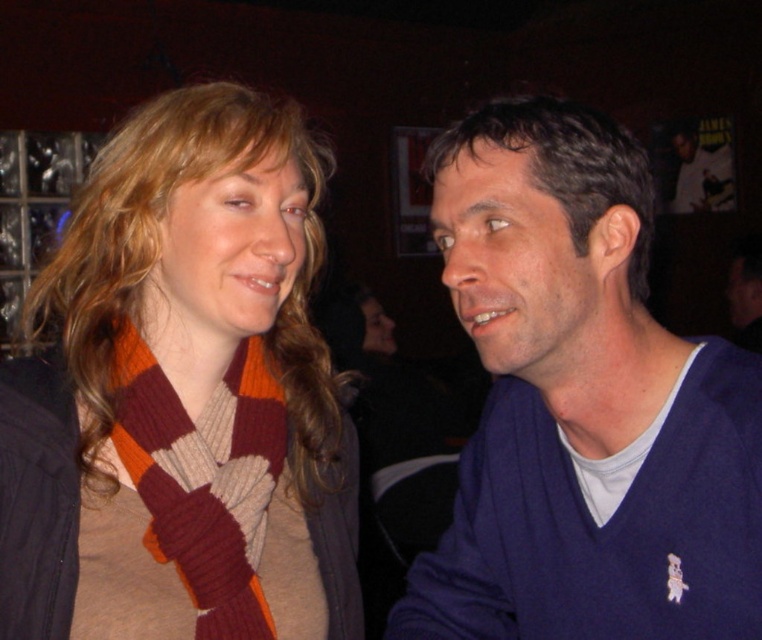
Question: Which point appears farthest from the camera in this image?

Choices:
 (A) (588, 205)
 (B) (740, 259)

Answer: (B)

Question: Can you confirm if blue sweater at right is thinner than dark brown smooth hair at upper right?

Choices:
 (A) no
 (B) yes

Answer: (A)

Question: Can you confirm if blue sweater at right is wider than dark brown smooth hair at upper right?

Choices:
 (A) no
 (B) yes

Answer: (B)

Question: Which object is the closest to the dark brown smooth hair at upper right?

Choices:
 (A) knitted scarf at center
 (B) matte blue sweater at right
 (C) knitted wool scarf at left
 (D) blue sweater at right

Answer: (D)

Question: Which of these objects is positioned farthest from the dark brown smooth hair at upper right?

Choices:
 (A) matte blue sweater at right
 (B) knitted scarf at center
 (C) knitted wool scarf at left

Answer: (A)

Question: Is knitted scarf at center thinner than matte blue sweater at right?

Choices:
 (A) yes
 (B) no

Answer: (A)